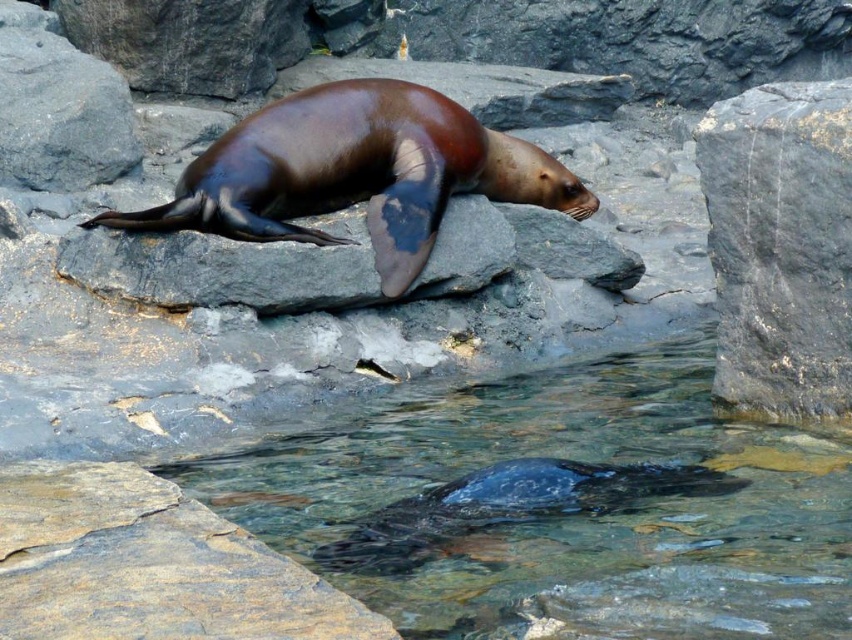
You are a wildlife photographer aiming to capture the sea lion without disturbing it. You have a camera with a 2.0 meter focal length lens. Can you take a clear photo of the sea lion from your current position between the gray rough rock at center right and the brown matte rock at center?

The gray rough rock at center right is 1.85 meters from the brown matte rock at center. Since your camera lens has a 2.0 meter focal length, which is longer than the distance between the rocks, you can take a clear photo of the sea lion from your current position between the gray rough rock at center right and the brown matte rock at center.

You are a marine biologist studying the habitat of the sea lion. You need to place a GPS tracker on a rock that is closer to the gray rough rock at center right than the brown smooth rock at lower center. Which rock should you choose?

The gray rough rock at center right is the closest to itself, so placing the GPS tracker on it would satisfy the requirement.

You are a photographer aiming to capture the brown smooth rock at lower center and the gray rough rock at center right in the same frame. Which rock will appear larger in your photo?

The brown smooth rock at lower center will appear larger in the photo because it is closer to the viewer than the gray rough rock at center right.